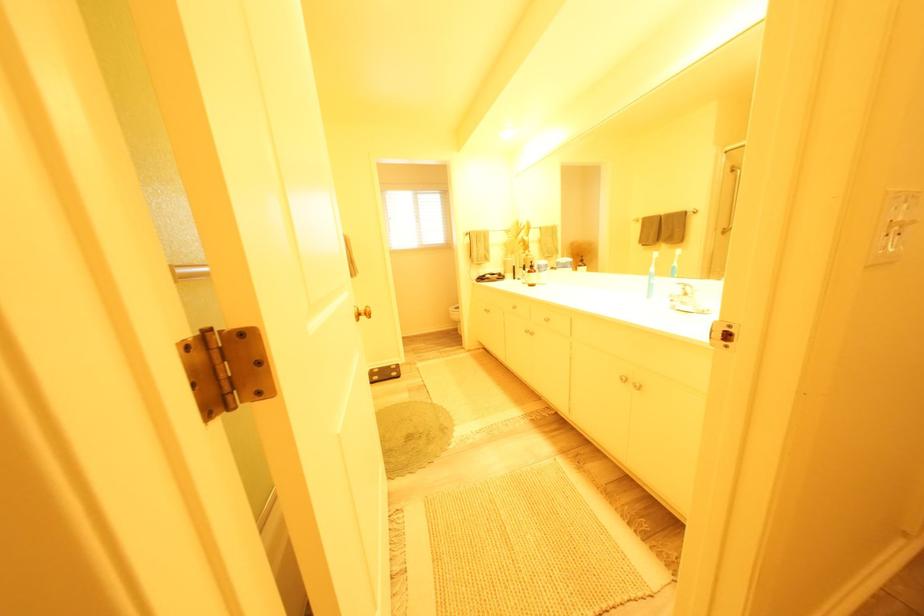
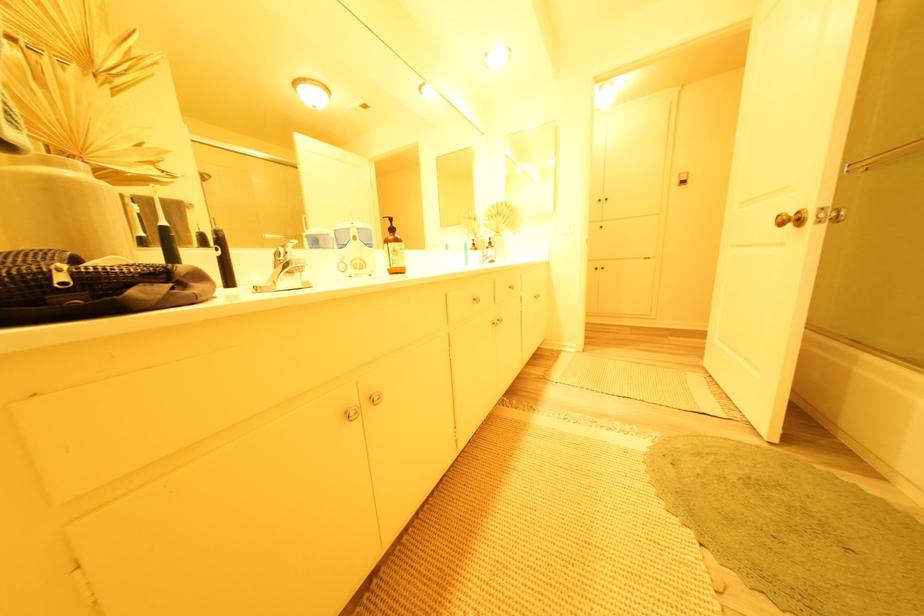
The point at (373, 320) is marked in the first image. Where is the corresponding point in the second image?

(801, 227)